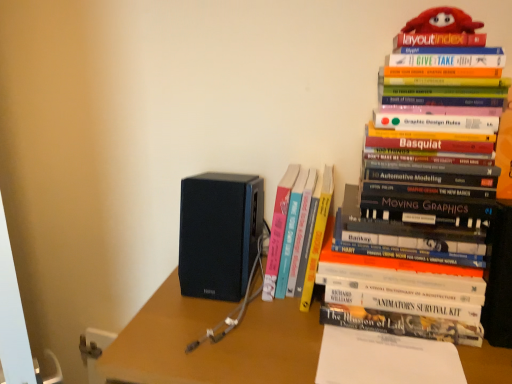
Question: In terms of height, does matte black speaker at center look taller or shorter compared to hardcover book at upper right, the 2th book viewed from the left?

Choices:
 (A) short
 (B) tall

Answer: (A)

Question: Is matte black speaker at center wider or thinner than hardcover book at upper right, arranged as the first book when viewed from the right?

Choices:
 (A) wide
 (B) thin

Answer: (A)

Question: Which is farther from the hardcover book at center, which is the second book in right-to-left order?

Choices:
 (A) white paper at center
 (B) matte black speaker at center
 (C) black matte speaker at center
 (D) hardcover book at upper right, the 2th book viewed from the left

Answer: (A)

Question: Which of these objects is positioned farthest from the hardcover book at center, which is the second book in right-to-left order?

Choices:
 (A) black matte speaker at center
 (B) matte black speaker at center
 (C) white paper at center
 (D) hardcover book at upper right, the 2th book viewed from the left

Answer: (C)